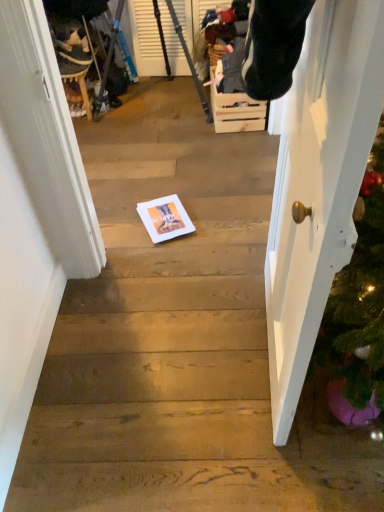
Question: From the image's perspective, is metallic tripod at upper left positioned above or below white paper at center?

Choices:
 (A) above
 (B) below

Answer: (A)

Question: Based on their sizes in the image, would you say metallic tripod at upper left is bigger or smaller than white paper at center?

Choices:
 (A) small
 (B) big

Answer: (B)

Question: Based on their relative distances, which object is nearer to the wooden crate at center?

Choices:
 (A) white paper at center
 (B) metallic tripod at upper left
 (C) velvet plush toy at upper left
 (D) white glossy door at right

Answer: (B)

Question: Which object is the closest to the velvet plush toy at upper left?

Choices:
 (A) metallic tripod at upper left
 (B) white glossy door at right
 (C) white paper at center
 (D) wooden crate at center

Answer: (A)